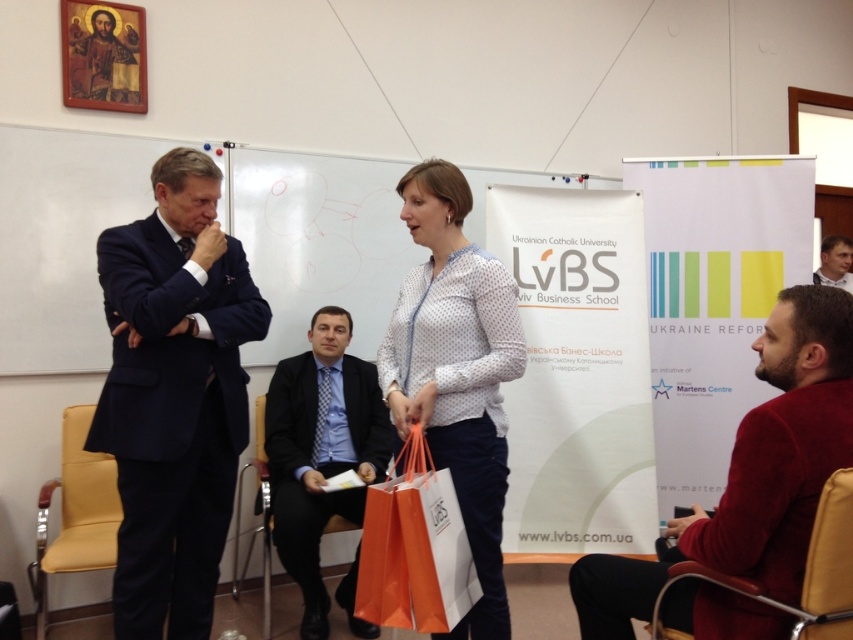
Is white dotted shirt at center above black leather chair at center?

Indeed, white dotted shirt at center is positioned over black leather chair at center.

Which is in front, point (502, 300) or point (265, 529)?

Point (502, 300) is more forward.

Where is `white dotted shirt at center`? This screenshot has width=853, height=640. white dotted shirt at center is located at coordinates (456, 371).

Is point (395, 516) in front of point (845, 285)?

Yes, point (395, 516) is in front of point (845, 285).

Is point (457, 612) farther from viewer compared to point (844, 282)?

No, it is in front of (844, 282).

At what (x,y) coordinates should I click in order to perform the action: click on orange paper bag at center. Please return your answer as a coordinate pair (x, y). Looking at the image, I should click on (415, 548).

Is navy blue suit at left taller than black leather chair at center?

Indeed, navy blue suit at left has a greater height compared to black leather chair at center.

In the scene shown: How far apart are navy blue suit at left and black leather chair at center?

They are 35.89 inches apart.

This screenshot has width=853, height=640. I want to click on navy blue suit at left, so point(173,396).